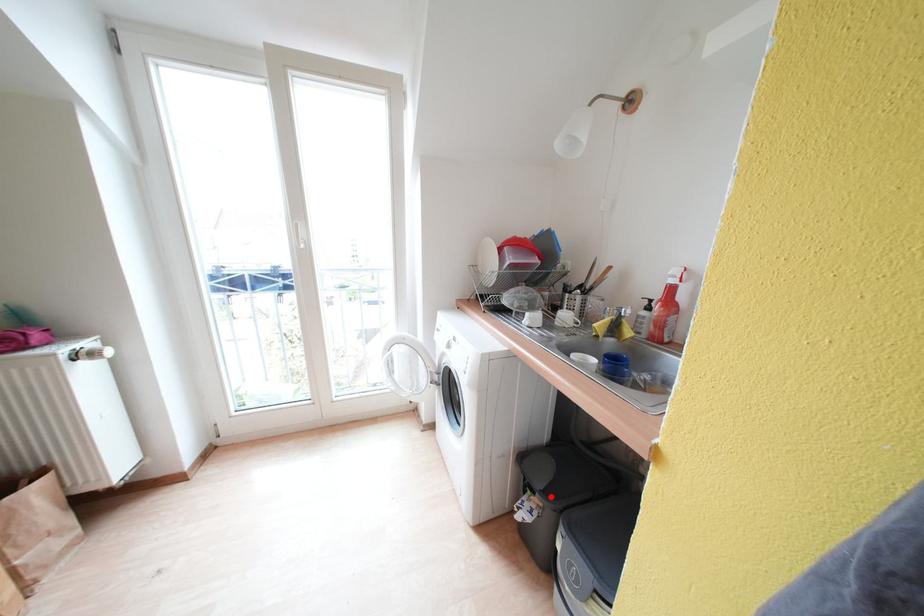
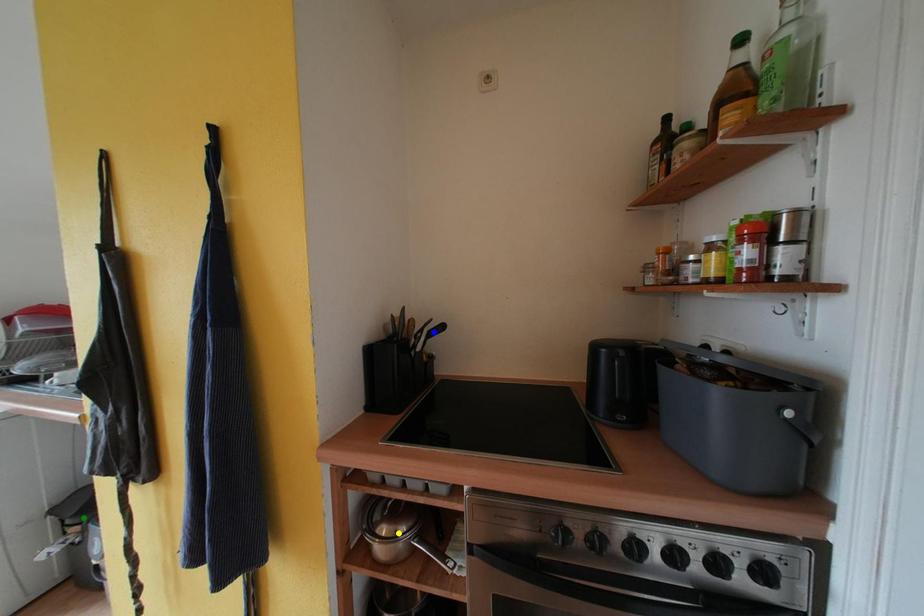
Question: I am providing you with two images of the same scene from different viewpoints. A red point is marked on the first image. You are given multiple points on the second image. In image 2, which mark is for the same physical point as the one in image 1?

Choices:
 (A) blue point
 (B) yellow point
 (C) green point

Answer: (C)